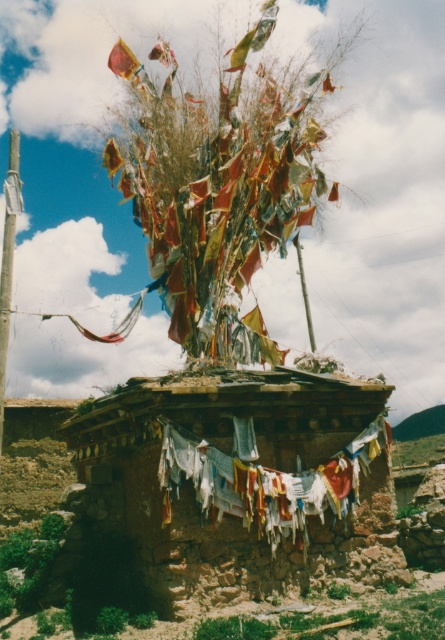
Does brown textured hut at center have a larger size compared to worn fabric clothesline at center?

Actually, brown textured hut at center might be smaller than worn fabric clothesline at center.

Identify the location of brown textured hut at center. (241, 481).

Which is more to the right, worn fabric clothesline at center or smooth concrete pole at left?

Positioned to the right is worn fabric clothesline at center.

You are a GUI agent. You are given a task and a screenshot of the screen. Output one action in this format:
    pyautogui.click(x=<x>, y=<y>)
    Task: Click on the worn fabric clothesline at center
    The width and height of the screenshot is (445, 640).
    Given the screenshot: What is the action you would take?
    pyautogui.click(x=265, y=481)

Locate an element on the screen. This screenshot has height=640, width=445. worn fabric clothesline at center is located at coordinates (265, 481).

Between point (128, 536) and point (4, 253), which one is positioned in front?

Point (4, 253) is in front.

Where is `brown textured hut at center`? Image resolution: width=445 pixels, height=640 pixels. brown textured hut at center is located at coordinates (241, 481).

Is point (335, 429) positioned before point (0, 333)?

That is False.

Identify the location of brown textured hut at center. (241, 481).